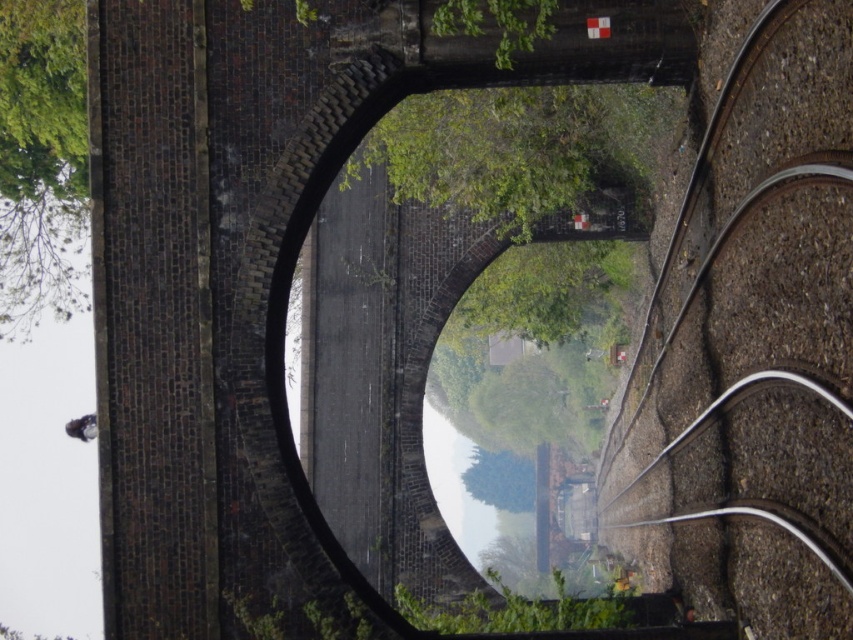
From the picture: You are standing at the point labeled point [538,195] and want to walk towards the point labeled point [42,202]. Given that the path between them is clear except for a small stream that flows directly between them, which direction should you turn to avoid the stream and reach your destination?

Since point [538,195] is in front of point [42,202], you should turn to the left to go around the stream and reach your destination.

You are a maintenance worker needing to inspect the brown gravel train track at right and the green leafy tree at upper left. Given that your inspection equipment has a maximum range of 35 meters, can you inspect both from your current position without moving?

The brown gravel train track at right and green leafy tree at upper left are 37.54 meters apart from each other. Since the distance exceeds the equipment range of 35 meters, you cannot inspect both from your current position without moving.